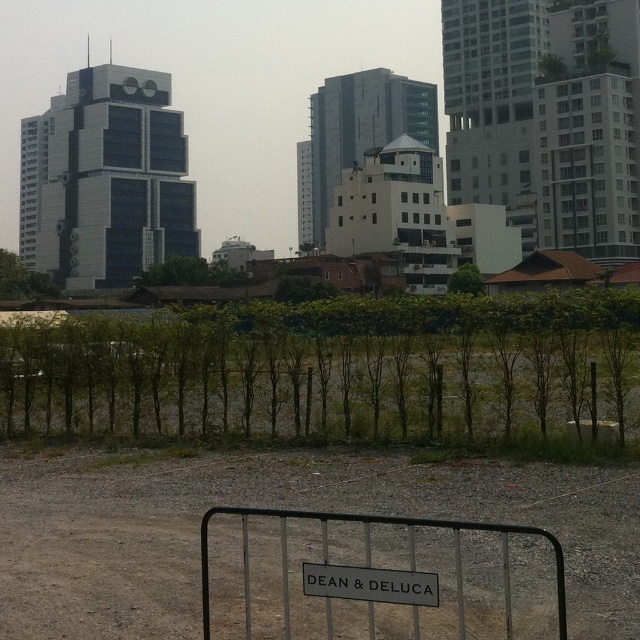
Can you confirm if dirt field at lower center is positioned to the right of metallic silver fence at lower center?

No, dirt field at lower center is not to the right of metallic silver fence at lower center.

Measure the distance between dirt field at lower center and camera.

20.97 feet

Image resolution: width=640 pixels, height=640 pixels. Identify the location of dirt field at lower center. (275, 506).

Can you confirm if dirt field at lower center is shorter than black metal sign at lower center?

In fact, dirt field at lower center may be taller than black metal sign at lower center.

Locate an element on the screen. This screenshot has width=640, height=640. dirt field at lower center is located at coordinates (275, 506).

Locate an element on the screen. The width and height of the screenshot is (640, 640). dirt field at lower center is located at coordinates (275, 506).

Which is below, metallic silver fence at lower center or black metal sign at lower center?

black metal sign at lower center is lower down.

Which is in front, point (202, 529) or point (339, 572)?

Point (339, 572)

Which is in front, point (285, 516) or point (339, 589)?

Positioned in front is point (339, 589).

Where is `metallic silver fence at lower center`? The height and width of the screenshot is (640, 640). metallic silver fence at lower center is located at coordinates (365, 548).